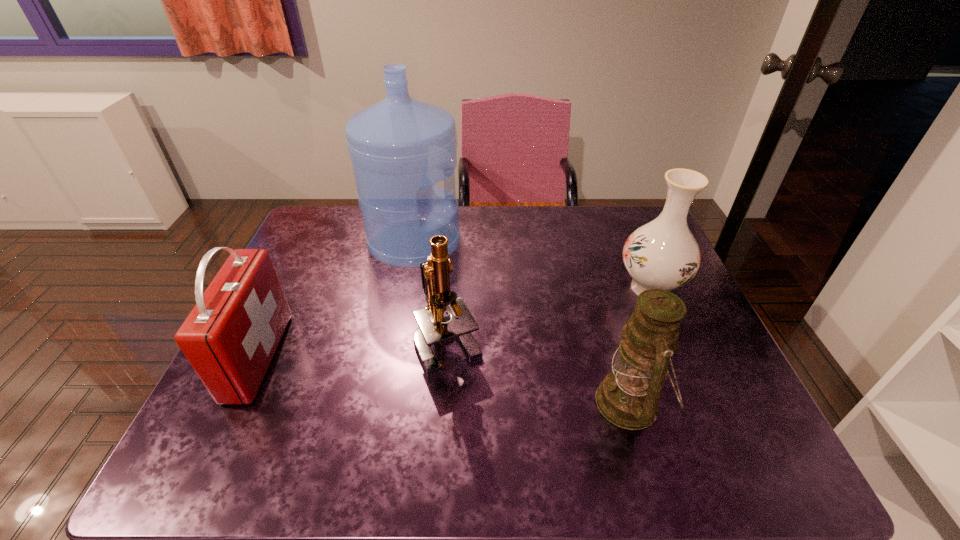
Identify the location of vacant position in the image that satisfies the following two spatial constraints: 1. on the back side of the oil lamp; 2. on the right side of the vase. (596, 288).

Where is `free spot that satisfies the following two spatial constraints: 1. at the eyepiece of the microscope; 2. on the left side of the oil lamp`? The width and height of the screenshot is (960, 540). free spot that satisfies the following two spatial constraints: 1. at the eyepiece of the microscope; 2. on the left side of the oil lamp is located at coordinates (444, 402).

At what (x,y) coordinates should I click in order to perform the action: click on free space that satisfies the following two spatial constraints: 1. on the front side of the vase; 2. on the front face of the first-aid kit. Please return your answer as a coordinate pair (x, y). Image resolution: width=960 pixels, height=540 pixels. Looking at the image, I should click on (680, 356).

Where is `free spot that satisfies the following two spatial constraints: 1. on the front face of the oil lamp; 2. on the right side of the first-aid kit`? free spot that satisfies the following two spatial constraints: 1. on the front face of the oil lamp; 2. on the right side of the first-aid kit is located at coordinates (237, 402).

What are the coordinates of `free space in the image that satisfies the following two spatial constraints: 1. on the front face of the leftmost object; 2. on the right side of the oil lamp` in the screenshot? It's located at (237, 402).

Identify the location of vacant space that satisfies the following two spatial constraints: 1. at the eyepiece of the oil lamp; 2. on the right side of the microscope. The width and height of the screenshot is (960, 540). (444, 402).

Image resolution: width=960 pixels, height=540 pixels. In order to click on vacant space that satisfies the following two spatial constraints: 1. on the side of the oil lamp with the handle; 2. on the right side of the tallest object in this screenshot , I will do `click(385, 402)`.

At what (x,y) coordinates should I click in order to perform the action: click on free spot that satisfies the following two spatial constraints: 1. on the back side of the vase; 2. on the right side of the oil lamp. Please return your answer as a coordinate pair (x, y). The image size is (960, 540). Looking at the image, I should click on (596, 288).